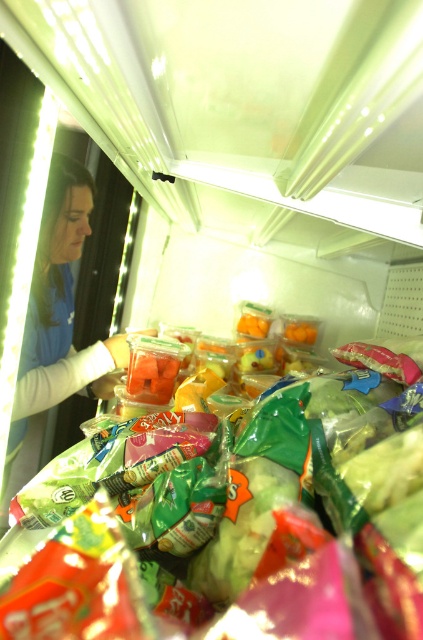
You are trying to reach for the translucent plastic bag of chips at center while standing near the blue fabric woman at left. Can you tell if the bag of chips is wider than the woman?

The translucent plastic bag of chips at center might be wider than blue fabric woman at left according to the description.

You are a customer in a grocery store looking at the refrigerated section. You see a translucent plastic bag of chips at center and a blue fabric woman at left. Which item is higher up on the shelf?

The translucent plastic bag of chips at center is higher up than the blue fabric woman at left.